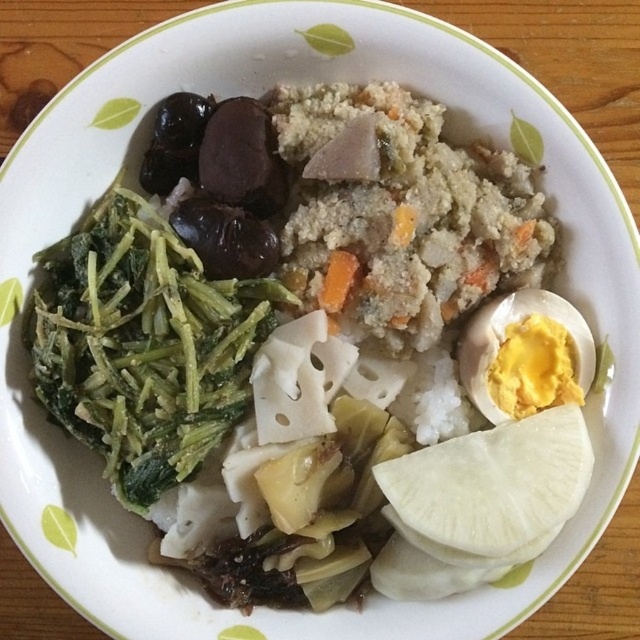
Question: Which point is closer to the camera?

Choices:
 (A) (170, 449)
 (B) (500, 312)

Answer: (A)

Question: Does green leafy vegetable at upper left appear over yellow soft-boiled egg at center-right?

Choices:
 (A) no
 (B) yes

Answer: (B)

Question: Among these objects, which one is nearest to the camera?

Choices:
 (A) green leafy vegetable at upper left
 (B) yellow soft-boiled egg at center-right

Answer: (A)

Question: Which of the following is the farthest from the observer?

Choices:
 (A) green leafy vegetable at upper left
 (B) yellow soft-boiled egg at center-right

Answer: (B)

Question: Can you confirm if green leafy vegetable at upper left is positioned above yellow soft-boiled egg at center-right?

Choices:
 (A) yes
 (B) no

Answer: (A)

Question: Can you confirm if green leafy vegetable at upper left is positioned to the left of yellow soft-boiled egg at center-right?

Choices:
 (A) no
 (B) yes

Answer: (B)